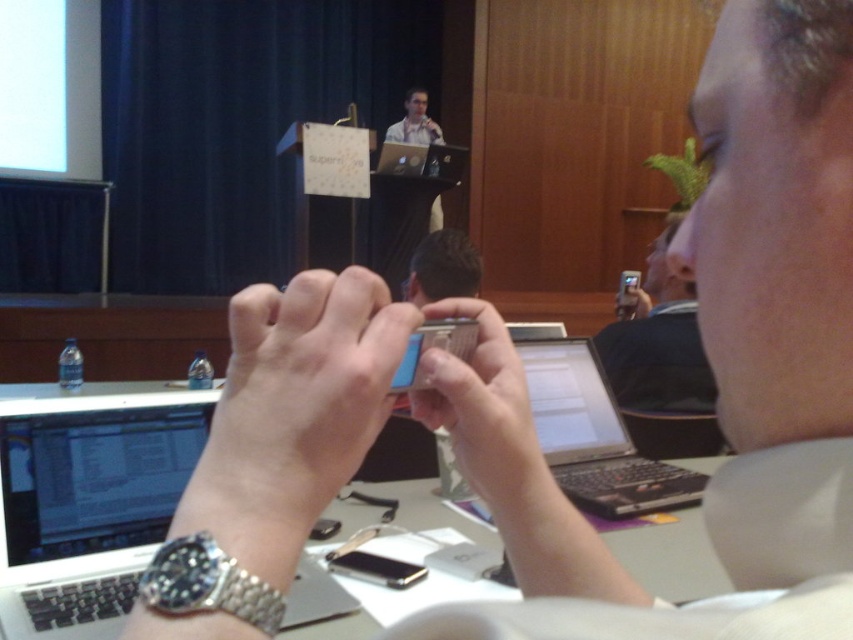
Locate an element on the screen. Image resolution: width=853 pixels, height=640 pixels. white matte laptop at lower left is located at coordinates (86, 499).

Can you confirm if white matte laptop at lower left is shorter than metallic silver phone at center?

Incorrect, white matte laptop at lower left's height does not fall short of metallic silver phone at center's.

Identify the location of white matte laptop at lower left. The height and width of the screenshot is (640, 853). (86, 499).

Does point (635, 556) come farther from viewer compared to point (589, 492)?

No, it is in front of (589, 492).

Does white plastic table at center appear under black plastic laptop at center?

Correct, white plastic table at center is located below black plastic laptop at center.

Identify the location of white plastic table at center. (86, 497).

Where is `silver metallic watch at center`? This screenshot has width=853, height=640. silver metallic watch at center is located at coordinates (293, 412).

Between silver metallic watch at center and metallic silver phone at center, which one has more height?

metallic silver phone at center is taller.

Is point (277, 556) more distant than point (457, 362)?

No.

The height and width of the screenshot is (640, 853). Identify the location of silver metallic watch at center. (293, 412).